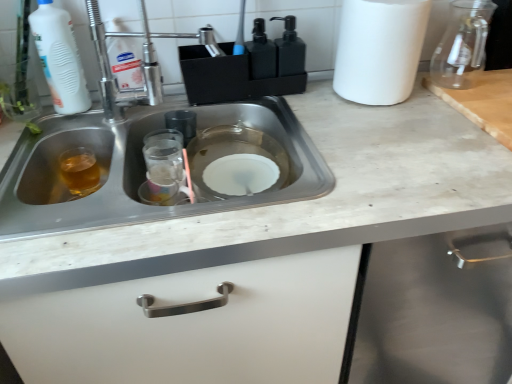
This screenshot has width=512, height=384. In order to click on free location in front of transparent glass jar at upper right in this screenshot , I will do `click(464, 112)`.